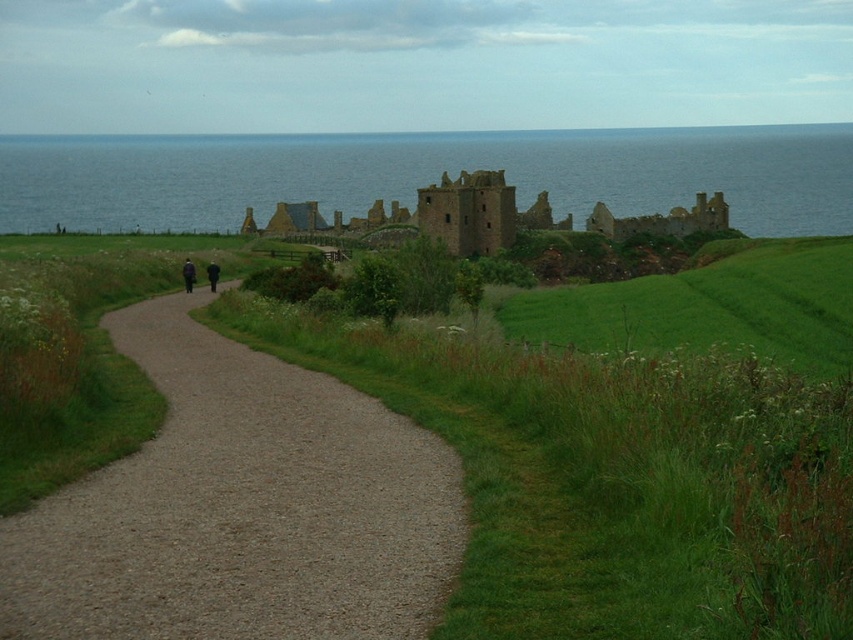
Is dark blue fabric at left above dark wool coat at center?

Incorrect, dark blue fabric at left is not positioned above dark wool coat at center.

Between point (194, 275) and point (212, 275), which one is positioned in front?

Positioned in front is point (194, 275).

Is point (189, 268) less distant than point (215, 262)?

Yes, point (189, 268) is closer to viewer.

Where is `dark blue fabric at left`? The width and height of the screenshot is (853, 640). dark blue fabric at left is located at coordinates (189, 275).

Which is above, gray gravel path at center or blue water at upper center?

Positioned higher is blue water at upper center.

Is gray gravel path at center below blue water at upper center?

Indeed, gray gravel path at center is positioned under blue water at upper center.

Does point (257, 419) come closer to viewer compared to point (659, 196)?

Yes.

Where is `gray gravel path at center`? Image resolution: width=853 pixels, height=640 pixels. gray gravel path at center is located at coordinates (241, 508).

Which of these two, brown stone ruins at center or dark blue fabric at left, stands taller?

Standing taller between the two is brown stone ruins at center.

Is brown stone ruins at center positioned in front of dark blue fabric at left?

That is False.

Who is more forward, (514, 200) or (184, 280)?

Positioned in front is point (184, 280).

The image size is (853, 640). I want to click on brown stone ruins at center, so click(x=431, y=216).